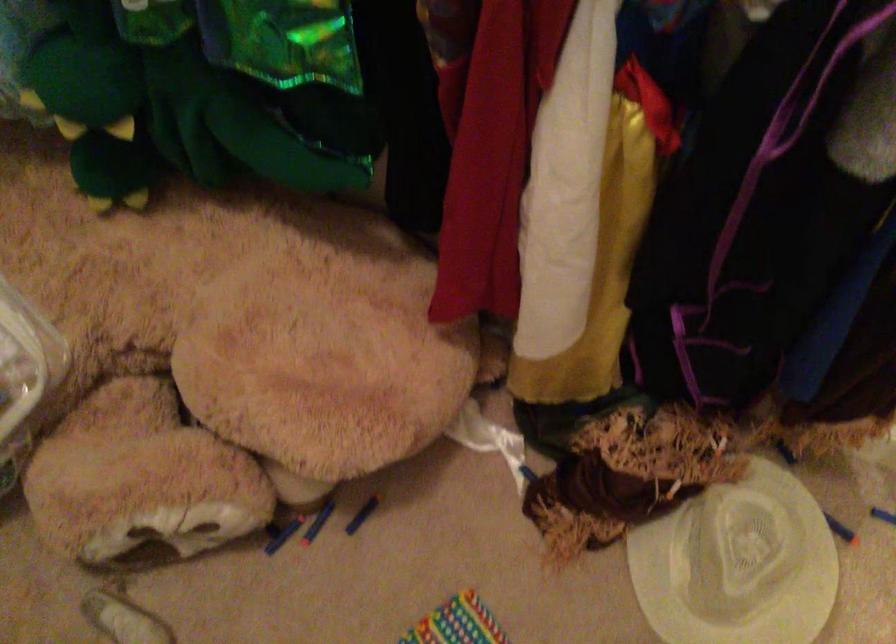
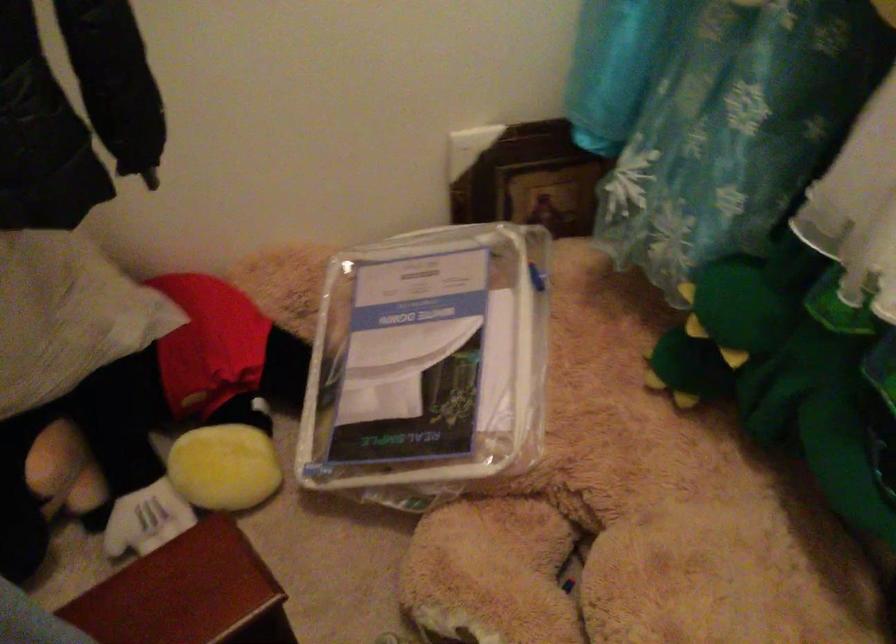
Where in the second image is the point corresponding to point 90,114 from the first image?

(719, 330)